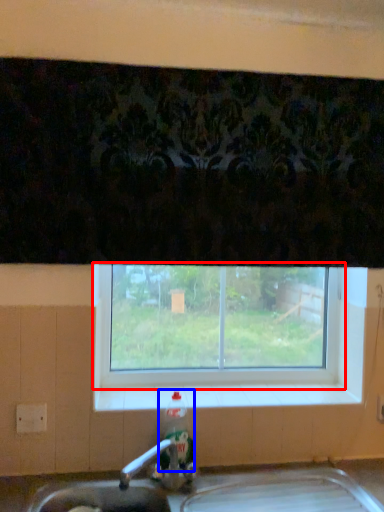
Question: Which object is further to the camera taking this photo, window (highlighted by a red box) or bottle (highlighted by a blue box)?

Choices:
 (A) window
 (B) bottle

Answer: (A)